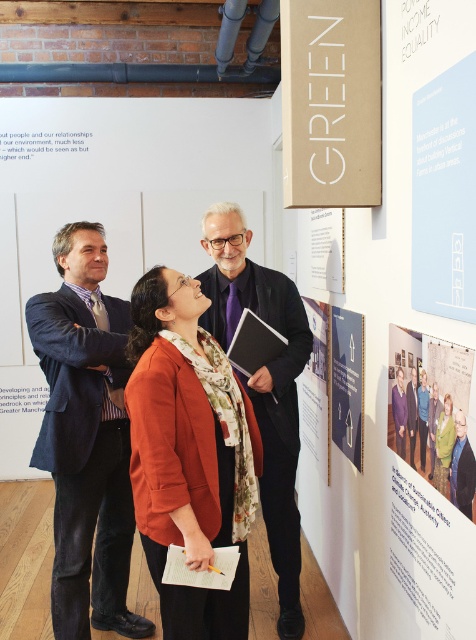
Does dark blue suit at center have a lesser height compared to light blue paper at upper right?

In fact, dark blue suit at center may be taller than light blue paper at upper right.

Who is more forward, (x=38, y=438) or (x=423, y=176)?

Point (x=423, y=176) is more forward.

Identify the location of dark blue suit at center. (86, 436).

Does dark blue suit at center have a smaller size compared to matte black poster at center?

Actually, dark blue suit at center might be larger than matte black poster at center.

Does dark blue suit at center lie behind matte black poster at center?

No.

What do you see at coordinates (86, 436) in the screenshot?
I see `dark blue suit at center` at bounding box center [86, 436].

You are a GUI agent. You are given a task and a screenshot of the screen. Output one action in this format:
    pyautogui.click(x=<x>, y=<y>)
    Task: Click on the dark blue suit at center
    
    Given the screenshot: What is the action you would take?
    pyautogui.click(x=86, y=436)

Is orange matte blazer at center thinner than matte paper poster at center?

Incorrect, orange matte blazer at center's width is not less than matte paper poster at center's.

Which is below, orange matte blazer at center or matte paper poster at center?

orange matte blazer at center is below.

Which is behind, point (230, 371) or point (427, 376)?

The point (230, 371) is behind.

The width and height of the screenshot is (476, 640). I want to click on orange matte blazer at center, so click(188, 452).